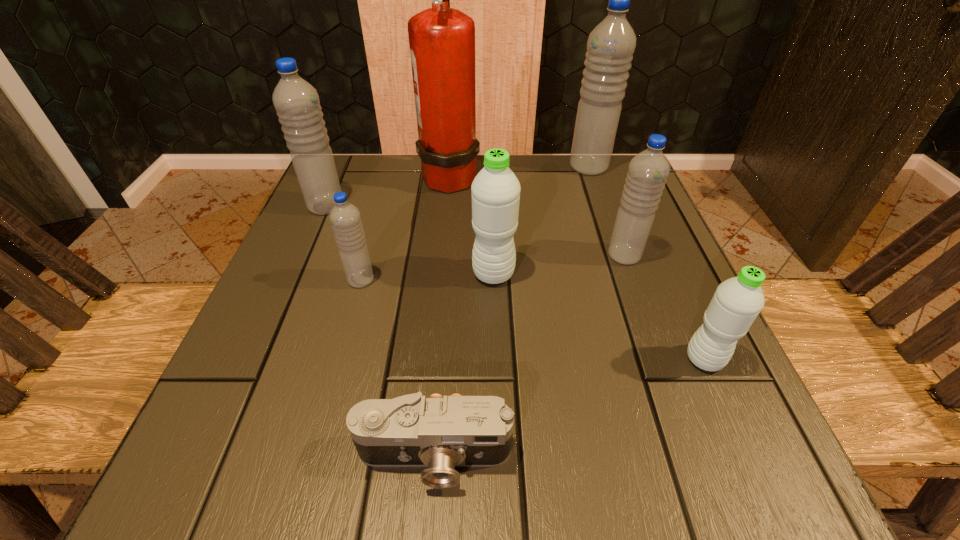
Point out which object is positioned as the seventh nearest to the tallest object. Please provide its 2D coordinates. Your answer should be formatted as a tuple, i.e. [(x, y)], where the tuple contains the x and y coordinates of a point satisfying the conditions above.

[(441, 433)]

Locate an element on the screen. This screenshot has width=960, height=540. object that is the seventh closest to the farther green water bottle is located at coordinates (610, 47).

At what (x,y) coordinates should I click in order to perform the action: click on water bottle that is the second closest to the second smallest blue water bottle. Please return your answer as a coordinate pair (x, y). The height and width of the screenshot is (540, 960). Looking at the image, I should click on (495, 190).

Identify the location of water bottle that is the fifth closest to the smaller green water bottle. The width and height of the screenshot is (960, 540). (296, 101).

Locate which blue water bottle is the closest to the nearest water bottle. Please provide its 2D coordinates. Your answer should be formatted as a tuple, i.e. [(x, y)], where the tuple contains the x and y coordinates of a point satisfying the conditions above.

[(648, 171)]

Choose which blue water bottle is the nearest neighbor to the fourth water bottle from right to left. Please provide its 2D coordinates. Your answer should be formatted as a tuple, i.e. [(x, y)], where the tuple contains the x and y coordinates of a point satisfying the conditions above.

[(345, 218)]

Image resolution: width=960 pixels, height=540 pixels. What are the coordinates of `vacant space that satisfies the following two spatial constraints: 1. at the nozzle of the nearest water bottle; 2. on the left side of the red fire extinguisher` in the screenshot? It's located at (433, 359).

This screenshot has width=960, height=540. Identify the location of blank area in the image that satisfies the following two spatial constraints: 1. on the front side of the third farthest blue water bottle; 2. on the right side of the fifth nearest water bottle. coord(304,255).

Locate an element on the screen. vacant position in the image that satisfies the following two spatial constraints: 1. at the nozzle of the second nearest blue water bottle; 2. on the right side of the red fire extinguisher is located at coordinates (443, 255).

Locate an element on the screen. This screenshot has width=960, height=540. free region that satisfies the following two spatial constraints: 1. on the back side of the left green water bottle; 2. on the left side of the smallest blue water bottle is located at coordinates (363, 274).